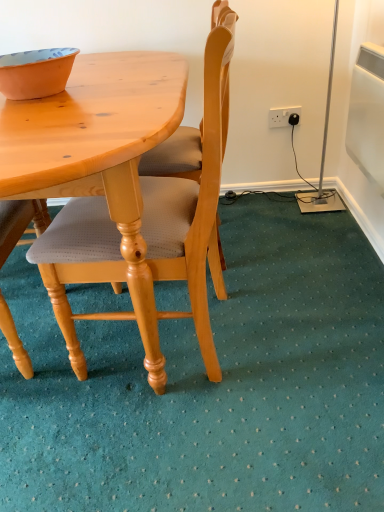
Find the location of a particular element. The image size is (384, 512). free location in front of light wood/light brown chair at center is located at coordinates (181, 441).